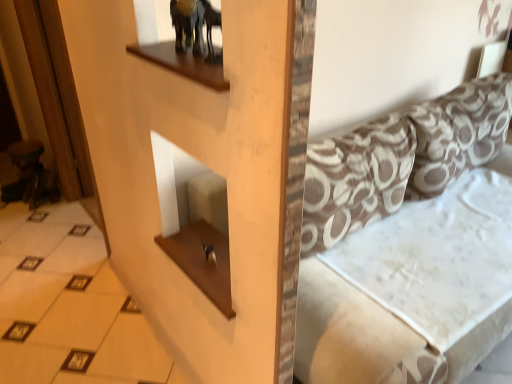
Question: From a real-world perspective, does white glossy tile at lower left sit lower than patterned fabric couch at center?

Choices:
 (A) yes
 (B) no

Answer: (A)

Question: Is white glossy tile at lower left smaller than patterned fabric couch at center?

Choices:
 (A) yes
 (B) no

Answer: (A)

Question: Does white glossy tile at lower left lie behind patterned fabric couch at center?

Choices:
 (A) yes
 (B) no

Answer: (A)

Question: Can we say white glossy tile at lower left lies outside patterned fabric couch at center?

Choices:
 (A) no
 (B) yes

Answer: (B)

Question: From a real-world perspective, is white glossy tile at lower left on top of patterned fabric couch at center?

Choices:
 (A) yes
 (B) no

Answer: (B)

Question: Considering the relative positions of patterned fabric couch at center and white glossy tile at lower left in the image provided, is patterned fabric couch at center to the left or to the right of white glossy tile at lower left?

Choices:
 (A) left
 (B) right

Answer: (B)

Question: Is patterned fabric couch at center taller or shorter than white glossy tile at lower left?

Choices:
 (A) short
 (B) tall

Answer: (B)

Question: Considering the positions of patterned fabric couch at center and white glossy tile at lower left in the image, is patterned fabric couch at center wider or thinner than white glossy tile at lower left?

Choices:
 (A) wide
 (B) thin

Answer: (A)

Question: From a real-world perspective, is patterned fabric couch at center above or below white glossy tile at lower left?

Choices:
 (A) below
 (B) above

Answer: (B)

Question: Is white glossy tile at lower left in front of or behind patterned fabric pillow at right, which is counted as the 1th pillow, starting from the right, in the image?

Choices:
 (A) behind
 (B) front

Answer: (B)

Question: From a real-world perspective, is white glossy tile at lower left above or below patterned fabric pillow at right, the 2th pillow positioned from the left?

Choices:
 (A) below
 (B) above

Answer: (A)

Question: Does point (75, 215) appear closer or farther from the camera than point (484, 84)?

Choices:
 (A) farther
 (B) closer

Answer: (A)

Question: Is white glossy tile at lower left wider or thinner than patterned fabric pillow at right, the 2th pillow positioned from the left?

Choices:
 (A) thin
 (B) wide

Answer: (B)

Question: Is brown printed fabric pillow at upper right, the 2th pillow positioned from the right, inside or outside of patterned fabric pillow at right, which is counted as the 1th pillow, starting from the right?

Choices:
 (A) outside
 (B) inside

Answer: (A)

Question: Would you say brown printed fabric pillow at upper right, the 2th pillow positioned from the right, is to the left or to the right of patterned fabric pillow at right, which is counted as the 1th pillow, starting from the right, in the picture?

Choices:
 (A) left
 (B) right

Answer: (A)